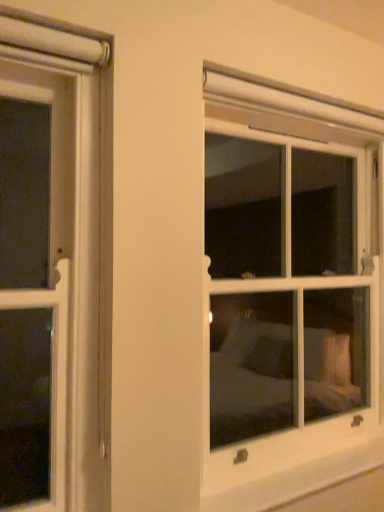
Question: Is clear glass window at center outside of white plastic window sill at lower right?

Choices:
 (A) yes
 (B) no

Answer: (A)

Question: Can you confirm if clear glass window at center is taller than white plastic window sill at lower right?

Choices:
 (A) no
 (B) yes

Answer: (B)

Question: From a real-world perspective, is clear glass window at center physically below white plastic window sill at lower right?

Choices:
 (A) yes
 (B) no

Answer: (B)

Question: Considering the relative positions of clear glass window at center and white plastic window sill at lower right in the image provided, is clear glass window at center to the right of white plastic window sill at lower right from the viewer's perspective?

Choices:
 (A) no
 (B) yes

Answer: (A)

Question: Considering the relative positions of clear glass window at center and white plastic window sill at lower right in the image provided, is clear glass window at center in front of white plastic window sill at lower right?

Choices:
 (A) no
 (B) yes

Answer: (A)

Question: Can you confirm if clear glass window at center is shorter than white plastic window sill at lower right?

Choices:
 (A) yes
 (B) no

Answer: (B)

Question: Considering the relative sizes of white plastic window sill at lower right and clear glass window at center in the image provided, is white plastic window sill at lower right shorter than clear glass window at center?

Choices:
 (A) yes
 (B) no

Answer: (A)

Question: Does white plastic window sill at lower right have a lesser width compared to clear glass window at center?

Choices:
 (A) no
 (B) yes

Answer: (B)

Question: Is white plastic window sill at lower right bigger than clear glass window at center?

Choices:
 (A) no
 (B) yes

Answer: (A)

Question: From the image's perspective, does white plastic window sill at lower right appear lower than clear glass window at center?

Choices:
 (A) no
 (B) yes

Answer: (B)

Question: Can you confirm if white plastic window sill at lower right is smaller than clear glass window at center?

Choices:
 (A) yes
 (B) no

Answer: (A)

Question: Is white plastic window sill at lower right positioned far away from clear glass window at center?

Choices:
 (A) yes
 (B) no

Answer: (A)

Question: Visually, is white plastic window sill at lower right positioned to the left or to the right of clear glass window at center?

Choices:
 (A) left
 (B) right

Answer: (B)